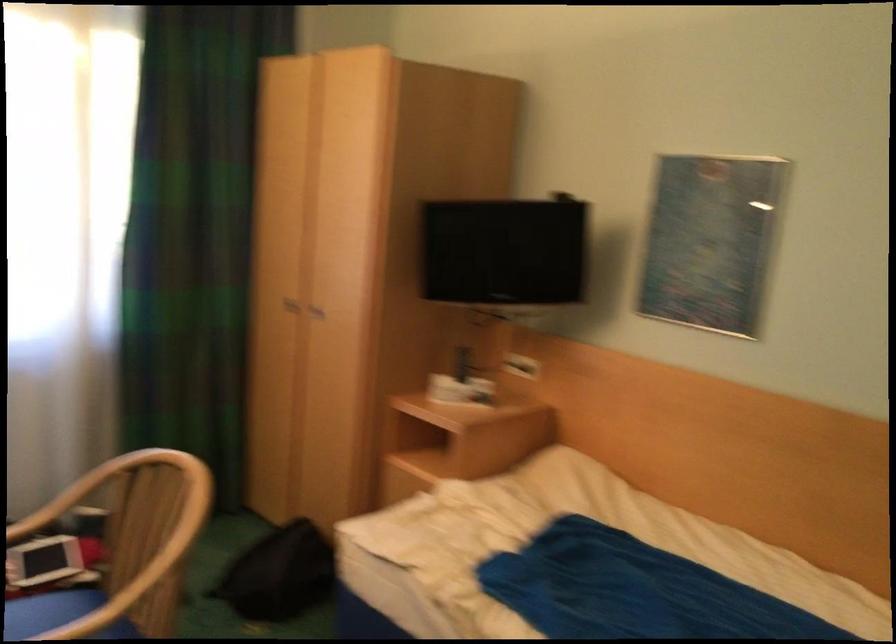
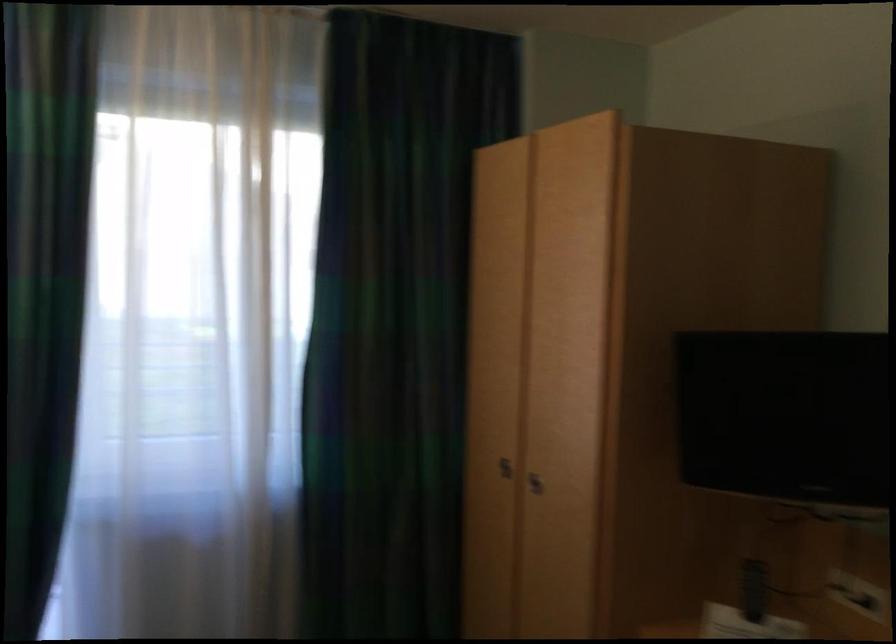
Where in the second image is the point corresponding to [319,313] from the first image?

(535, 483)